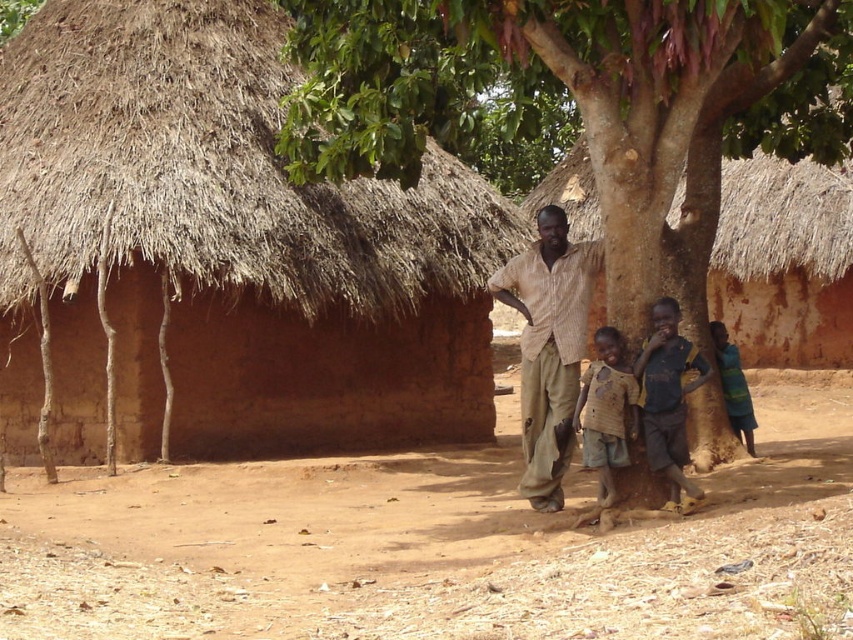
Question: Can you confirm if brown sandy dirt at lower center is positioned to the right of light brown striped shirt at center?

Choices:
 (A) yes
 (B) no

Answer: (B)

Question: Can you confirm if brown sandy dirt at lower center is bigger than thatched straw roof at upper center?

Choices:
 (A) no
 (B) yes

Answer: (B)

Question: Which object is positioned closest to the brown textured shirt at center?

Choices:
 (A) thatched straw roof at upper center
 (B) light brown striped shirt at center
 (C) blue striped fabric at lower right
 (D) brown mud hut at center

Answer: (B)

Question: Is thatched straw roof at upper center behind dark blue jersey at center?

Choices:
 (A) no
 (B) yes

Answer: (B)

Question: Which of the following is the closest to the observer?

Choices:
 (A) (349, 259)
 (B) (782, 193)
 (C) (602, 342)
 (D) (328, 24)

Answer: (C)

Question: Which object appears closest to the camera in this image?

Choices:
 (A) brown textured shirt at center
 (B) thatched straw roof at upper center
 (C) blue striped fabric at lower right
 (D) green leafy tree at center

Answer: (A)